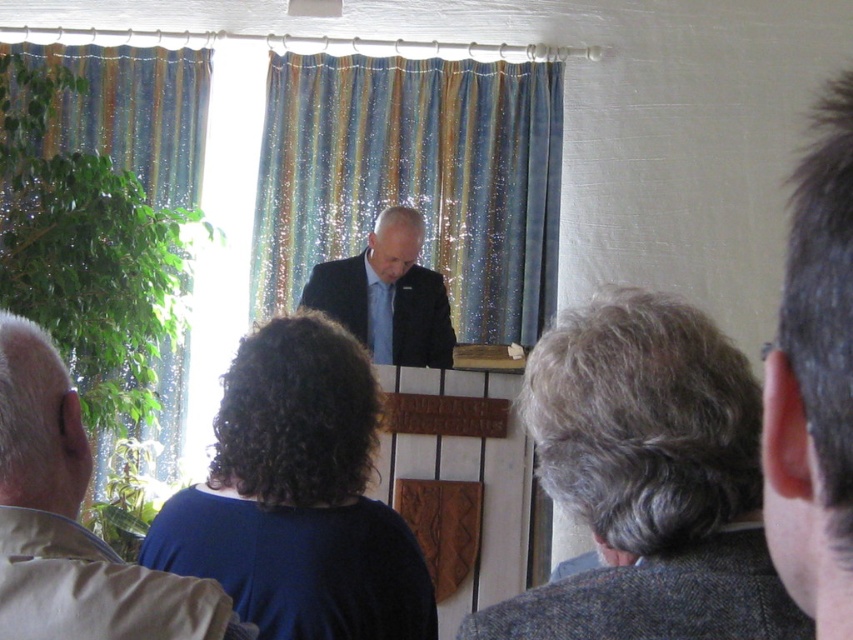
You are standing at the entrance of the room and see the blue striped curtain at center located at point (415, 179). If you walk straight ahead, will you walk into the blue striped curtain at center?

Yes, the blue striped curtain at center is located at point (415, 179), so walking straight ahead from the entrance would lead you directly to the blue striped curtain at center.

You are standing at the center of the room and want to move towards the striped fabric curtain at left. Which direction should you face to walk straight towards it?

The striped fabric curtain at left is located at point 0.336 on the x axis and 0.122 on the y axis. Since you are at the center, facing towards the left side of the room would align you with the striped fabric curtain at left.